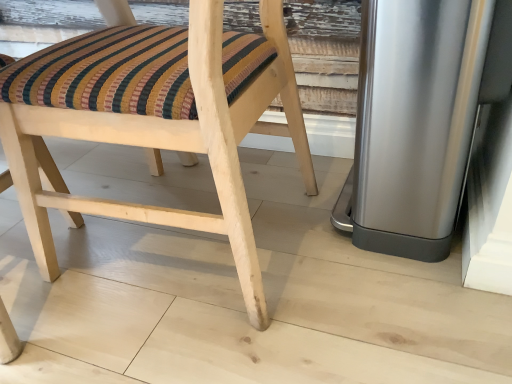
Question: Is polished stainless steel trash can at right with natural wood chair at center?

Choices:
 (A) yes
 (B) no

Answer: (B)

Question: Is polished stainless steel trash can at right facing away from natural wood chair at center?

Choices:
 (A) no
 (B) yes

Answer: (A)

Question: Could you tell me if polished stainless steel trash can at right is turned towards natural wood chair at center?

Choices:
 (A) yes
 (B) no

Answer: (B)

Question: Would you say natural wood chair at center is part of polished stainless steel trash can at right's contents?

Choices:
 (A) yes
 (B) no

Answer: (B)

Question: Considering the relative positions of polished stainless steel trash can at right and natural wood chair at center in the image provided, is polished stainless steel trash can at right to the right of natural wood chair at center from the viewer's perspective?

Choices:
 (A) yes
 (B) no

Answer: (A)

Question: From a real-world perspective, does polished stainless steel trash can at right sit lower than natural wood chair at center?

Choices:
 (A) yes
 (B) no

Answer: (A)

Question: Could you tell me if natural wood chair at center is facing polished stainless steel trash can at right?

Choices:
 (A) no
 (B) yes

Answer: (A)

Question: From the image's perspective, is natural wood chair at center on polished stainless steel trash can at right?

Choices:
 (A) no
 (B) yes

Answer: (A)

Question: Can you confirm if natural wood chair at center is thinner than polished stainless steel trash can at right?

Choices:
 (A) yes
 (B) no

Answer: (B)

Question: Is natural wood chair at center shorter than polished stainless steel trash can at right?

Choices:
 (A) yes
 (B) no

Answer: (B)

Question: Is natural wood chair at center not near polished stainless steel trash can at right?

Choices:
 (A) yes
 (B) no

Answer: (B)

Question: From a real-world perspective, is natural wood chair at center positioned under polished stainless steel trash can at right based on gravity?

Choices:
 (A) no
 (B) yes

Answer: (A)

Question: In the image, is polished stainless steel trash can at right positioned in front of or behind natural wood chair at center?

Choices:
 (A) behind
 (B) front

Answer: (A)